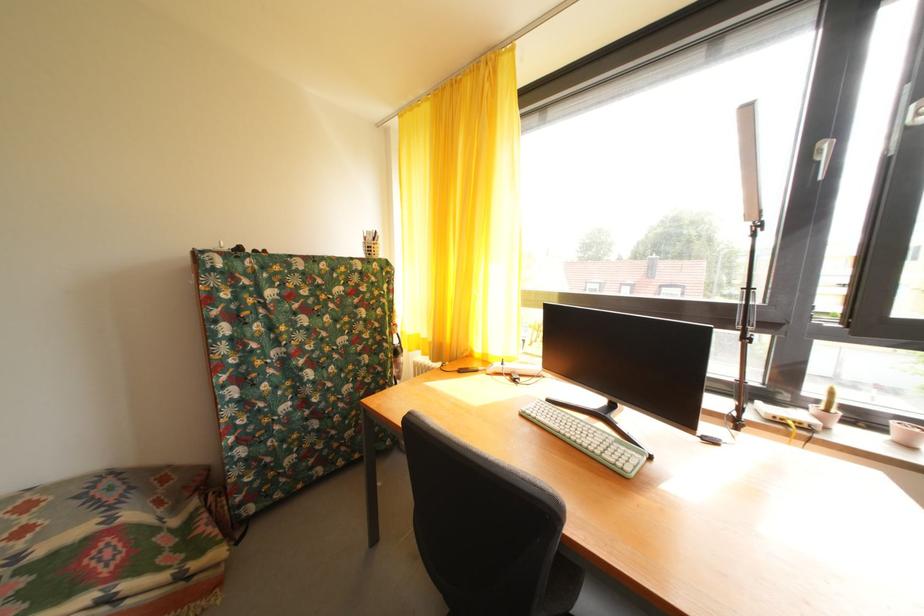
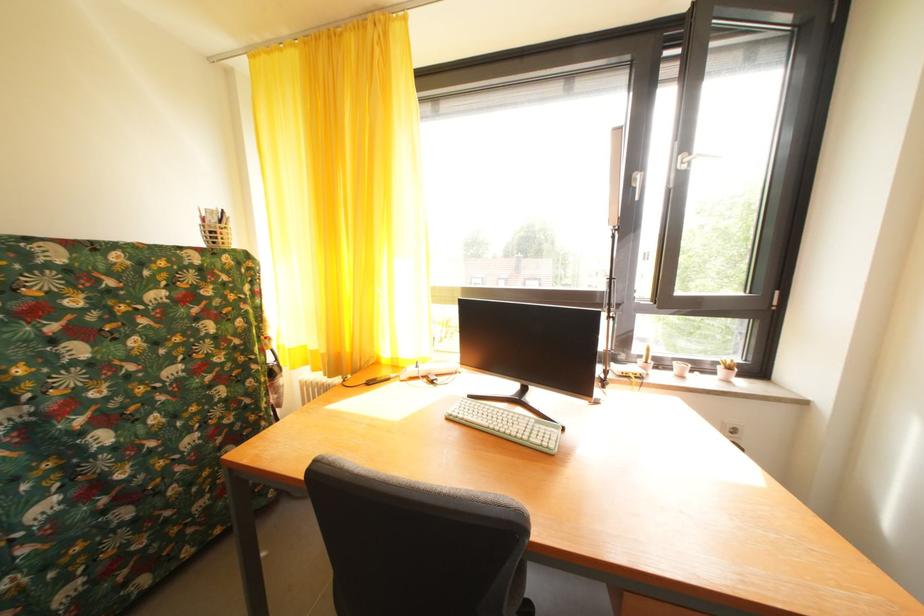
Question: The first image is from the beginning of the video and the second image is from the end. How did the camera likely rotate when shooting the video?

Choices:
 (A) Left
 (B) Right
 (C) Up
 (D) Down

Answer: (B)